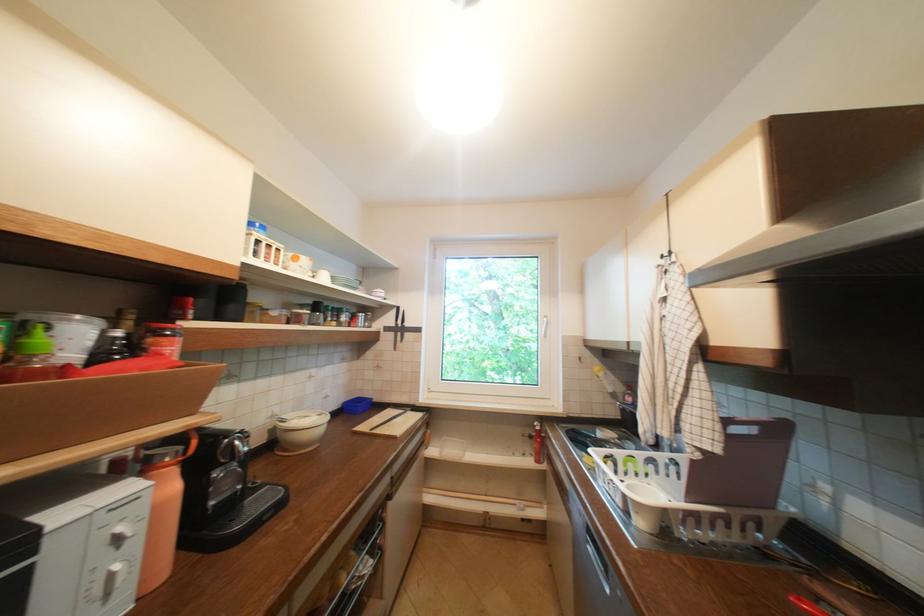
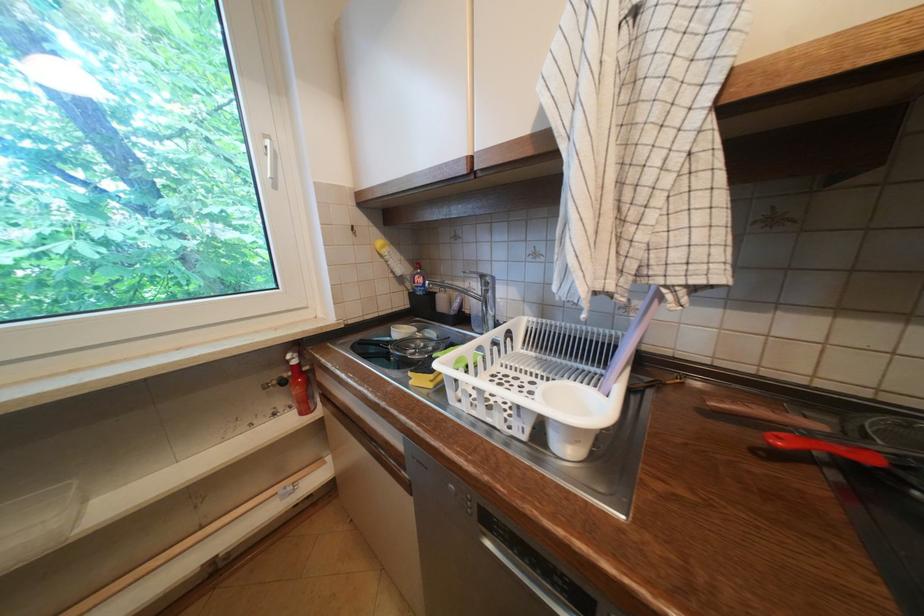
Locate, in the second image, the point that corresponds to the point at 609,379 in the first image.

(394, 259)